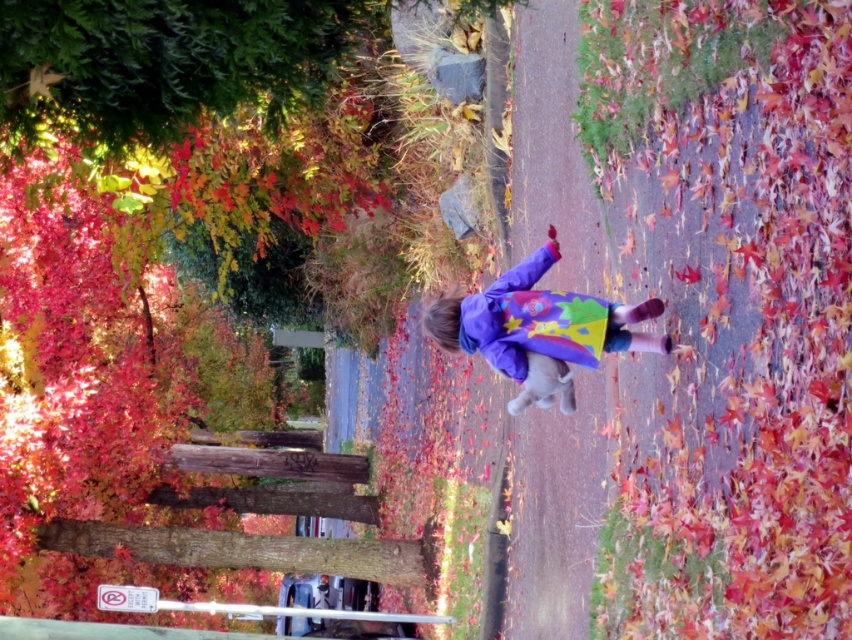
You are a photographer standing at the starting point of the path. You want to take a photo that includes both the green leafy tree at upper left and the purple fleece jacket at center. What is the minimum distance you need to move forward or backward to ensure both are in the frame?

The green leafy tree at upper left and purple fleece jacket at center are 4.61 feet apart from each other. To include both in the frame, you need to position yourself so that the distance between them fits within your camera lens field of view. Since the exact field of view isn

You are a photographer trying to capture the child walking along the path. You notice the multicolored fabric at center and the green leafy tree at upper left in your viewfinder. Which object should you position on the right side of your frame to include both elements?

You should position the green leafy tree at upper left on the left side of your frame so that the multicolored fabric at center can be placed to its right, as the multicolored fabric at center is to the right of green leafy tree at upper left according to the description.